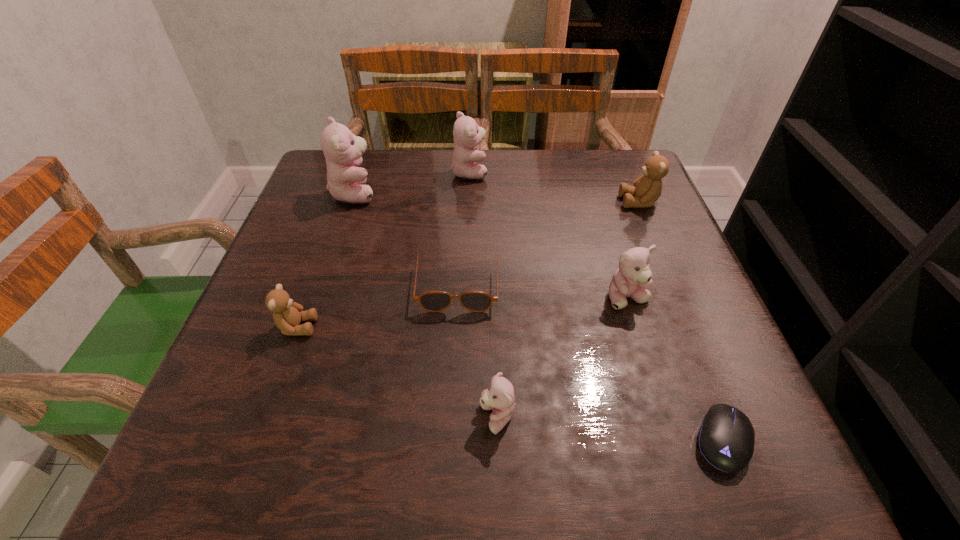
Identify the location of free space that is in between the nearer brown teddy bear and the second tallest teddy bear. Image resolution: width=960 pixels, height=540 pixels. (383, 249).

Where is `blank region between the right brown teddy bear and the tallest teddy bear`? This screenshot has height=540, width=960. blank region between the right brown teddy bear and the tallest teddy bear is located at coordinates (497, 197).

At what (x,y) coordinates should I click in order to perform the action: click on free space that is in between the leftmost pink teddy bear and the third biggest pink teddy bear. Please return your answer as a coordinate pair (x, y). This screenshot has height=540, width=960. Looking at the image, I should click on (492, 246).

Locate an element on the screen. This screenshot has height=540, width=960. free area in between the bigger brown teddy bear and the left brown teddy bear is located at coordinates (468, 264).

Identify the location of empty space that is in between the farther brown teddy bear and the brown sunglasses. The image size is (960, 540). (548, 242).

You are a GUI agent. You are given a task and a screenshot of the screen. Output one action in this format:
    pyautogui.click(x=<x>, y=<y>)
    Task: Click on the free space between the third smallest pink teddy bear and the tallest teddy bear
    This screenshot has width=960, height=540.
    Given the screenshot: What is the action you would take?
    pyautogui.click(x=412, y=183)

Where is `vacant area between the fifth teddy bear from left to right and the smallest pink teddy bear`? This screenshot has height=540, width=960. vacant area between the fifth teddy bear from left to right and the smallest pink teddy bear is located at coordinates (563, 358).

You are a GUI agent. You are given a task and a screenshot of the screen. Output one action in this format:
    pyautogui.click(x=<x>, y=<y>)
    Task: Click on the vacant space in between the shortest object and the nearest pink teddy bear
    This screenshot has width=960, height=540.
    Given the screenshot: What is the action you would take?
    pyautogui.click(x=610, y=429)

Where is `unoccupied area between the shortest object and the second nearest pink teddy bear`? This screenshot has width=960, height=540. unoccupied area between the shortest object and the second nearest pink teddy bear is located at coordinates (675, 369).

Find the location of a particular element. free point between the nearest teddy bear and the black computer mouse is located at coordinates (610, 429).